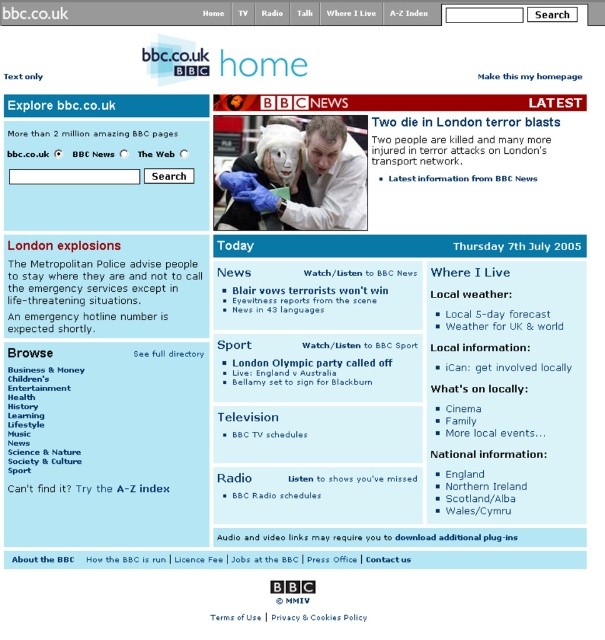
You are a visually impaired user navigating the BBC.co.uk homepage from July 7th, 2005. You want to locate the text only version of the page. Which object is positioned lower on the screen between the white paper at upper left and the matte white lab coat at center?

The white paper at upper left is positioned lower on the screen than the matte white lab coat at center.

You are a web designer analyzing the BBC.co.uk homepage from July 7th, 2005. You notice two elements on the page, the white paper at upper left and the matte white lab coat at center. Which element is positioned higher on the page?

The white paper at upper left is positioned higher on the page than the matte white lab coat at center.

You are a visually impaired user navigating the BBC website. You see the white paper at upper left and the matte white lab coat at center. Which object can you more easily read the text on?

The matte white lab coat at center has a larger size than the white paper at upper left, so the text on the matte white lab coat at center would be easier to read.